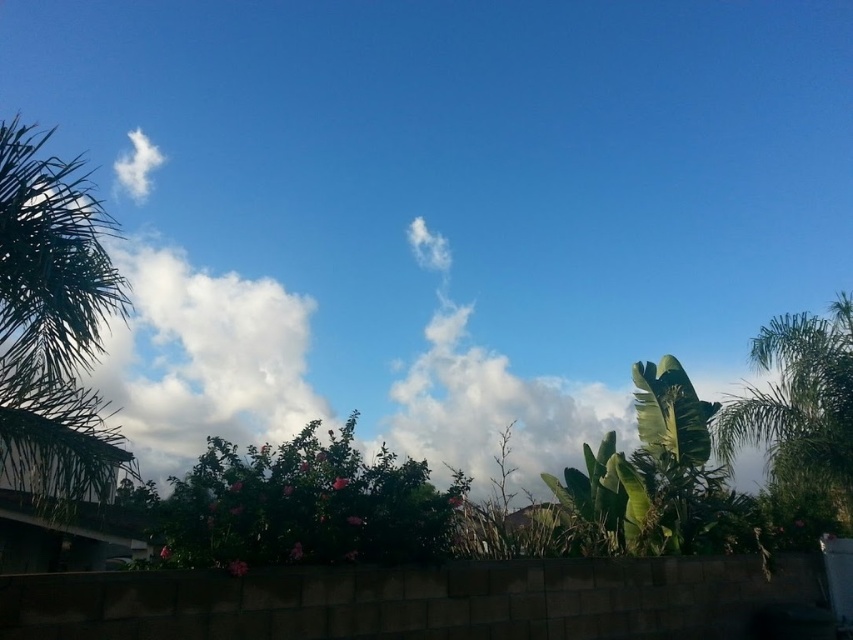
Question: Which point appears farthest from the camera in this image?

Choices:
 (A) (750, 426)
 (B) (410, 552)

Answer: (A)

Question: Considering the real-world distances, which object is farthest from the green leafy palm tree at left?

Choices:
 (A) green leafy palm tree at right
 (B) green leafy bush at center

Answer: (A)

Question: Is green leafy palm tree at left positioned before green leafy bush at center?

Choices:
 (A) yes
 (B) no

Answer: (B)

Question: Which point is farther to the camera?

Choices:
 (A) green leafy palm tree at right
 (B) green leafy palm tree at left
 (C) green leafy bush at center

Answer: (A)

Question: Is green leafy palm tree at left wider than green leafy palm tree at right?

Choices:
 (A) no
 (B) yes

Answer: (B)

Question: Does green leafy palm tree at left have a greater width compared to green leafy palm tree at right?

Choices:
 (A) no
 (B) yes

Answer: (B)